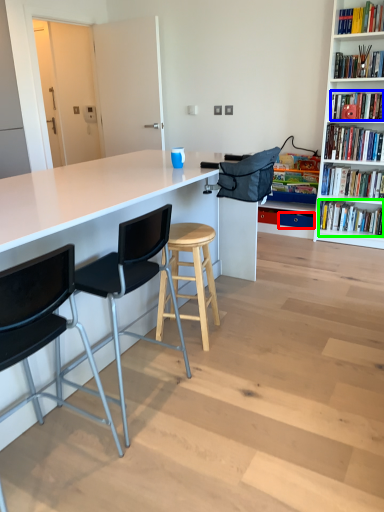
Question: Estimate the real-world distances between objects in this image. Which object is closer to drawer (highlighted by a red box), book (highlighted by a blue box) or book (highlighted by a green box)?

Choices:
 (A) book
 (B) book

Answer: (B)